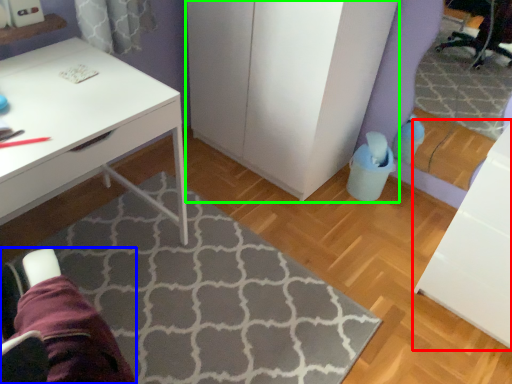
Question: Which is nearer to the file cabinet (highlighted by a red box)? swivel chair (highlighted by a blue box) or dresser (highlighted by a green box).

Choices:
 (A) swivel chair
 (B) dresser

Answer: (B)